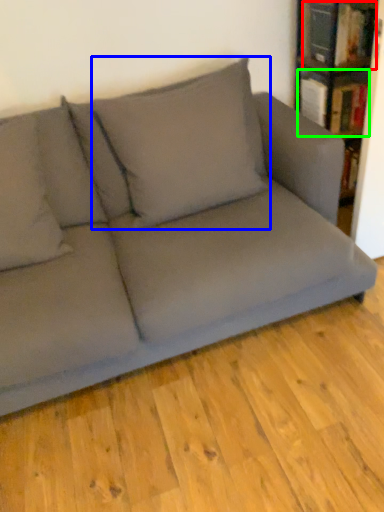
Question: Based on their relative distances, which object is farther from book (highlighted by a red box)? Choose from pillow (highlighted by a blue box) and book (highlighted by a green box).

Choices:
 (A) pillow
 (B) book

Answer: (A)